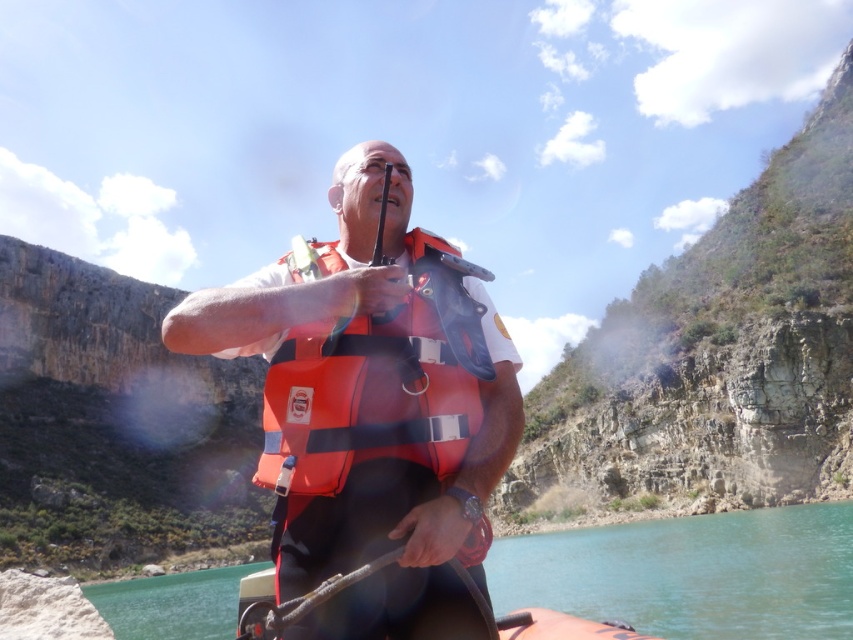
You are a drone operator trying to capture a photo of the man on the boat. The drone is currently positioned at point A, which is at coordinates point (572, 609). You need to adjust the drone to point B at coordinates point (383, 342) to get a better shot. Will moving the drone from point A to point B bring it closer to the man?

Yes, moving the drone from point (572, 609) to point (383, 342) will bring it closer to the man because point (572, 609) is further away from the camera than point (383, 342).

You are a rescue worker who needs to assess the water level in the scene. Based on the image, which object is higher in elevation between the clear water at lower center and the orange fabric life vest at center?

The clear water at lower center is much taller than the orange fabric life vest at center, so the clear water at lower center is higher in elevation.